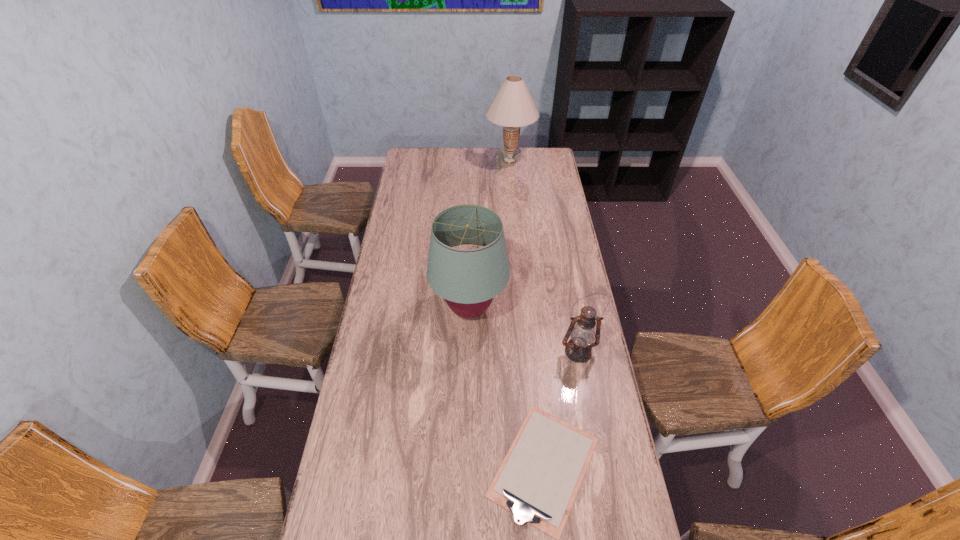
Find the location of a particular element. The height and width of the screenshot is (540, 960). the farther lampshade is located at coordinates (513, 107).

In order to click on the second farthest object in this screenshot , I will do `click(468, 279)`.

Identify the location of oil lamp. (579, 349).

The height and width of the screenshot is (540, 960). I want to click on the third farthest object, so click(x=579, y=349).

Find the location of a particular element. The width and height of the screenshot is (960, 540). free space located 0.060m on the front of the farthest object is located at coordinates (512, 180).

This screenshot has width=960, height=540. In order to click on vacant space situated on the left of the nearer lampshade in this screenshot , I will do `click(372, 309)`.

The image size is (960, 540). Identify the location of free space located on the left of the oil lamp. (492, 352).

Find the location of a particular element. The width and height of the screenshot is (960, 540). object located in the far edge section of the desktop is located at coordinates (513, 107).

At what (x,y) coordinates should I click in order to perform the action: click on lampshade at the right edge. Please return your answer as a coordinate pair (x, y). This screenshot has width=960, height=540. Looking at the image, I should click on (513, 107).

Where is `oil lamp positioned at the right edge`? The width and height of the screenshot is (960, 540). oil lamp positioned at the right edge is located at coordinates (579, 349).